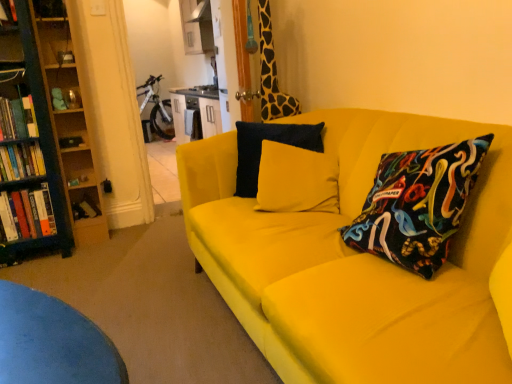
Question: Could you tell me if yellow fabric couch at center is turned towards hardcover book at left, the 4th book ordered from the bottom?

Choices:
 (A) no
 (B) yes

Answer: (A)

Question: Is yellow fabric couch at center next to hardcover book at left, the 4th book ordered from the bottom, and touching it?

Choices:
 (A) yes
 (B) no

Answer: (B)

Question: Could hardcover book at left, the 1th book in the top-to-bottom sequence, be considered to be inside yellow fabric couch at center?

Choices:
 (A) no
 (B) yes

Answer: (A)

Question: Does yellow fabric couch at center appear on the right side of hardcover book at left, the 1th book in the top-to-bottom sequence?

Choices:
 (A) yes
 (B) no

Answer: (A)

Question: Is yellow fabric couch at center positioned far away from hardcover book at left, the 1th book in the top-to-bottom sequence?

Choices:
 (A) no
 (B) yes

Answer: (B)

Question: Is yellow fabric couch at center to the left of hardcover book at left, the 4th book ordered from the bottom, from the viewer's perspective?

Choices:
 (A) yes
 (B) no

Answer: (B)

Question: From the image's perspective, is giraffe-patterned fabric at upper right over white glossy bicycle at upper center?

Choices:
 (A) no
 (B) yes

Answer: (A)

Question: Could white glossy bicycle at upper center be considered to be inside giraffe-patterned fabric at upper right?

Choices:
 (A) yes
 (B) no

Answer: (B)

Question: Does giraffe-patterned fabric at upper right have a smaller size compared to white glossy bicycle at upper center?

Choices:
 (A) no
 (B) yes

Answer: (B)

Question: Does giraffe-patterned fabric at upper right appear on the left side of white glossy bicycle at upper center?

Choices:
 (A) no
 (B) yes

Answer: (A)

Question: Is giraffe-patterned fabric at upper right placed right next to white glossy bicycle at upper center?

Choices:
 (A) no
 (B) yes

Answer: (A)

Question: Is there a large distance between giraffe-patterned fabric at upper right and white glossy bicycle at upper center?

Choices:
 (A) no
 (B) yes

Answer: (B)

Question: Is wooden bookshelf at left with matte yellow pillow at center?

Choices:
 (A) no
 (B) yes

Answer: (A)